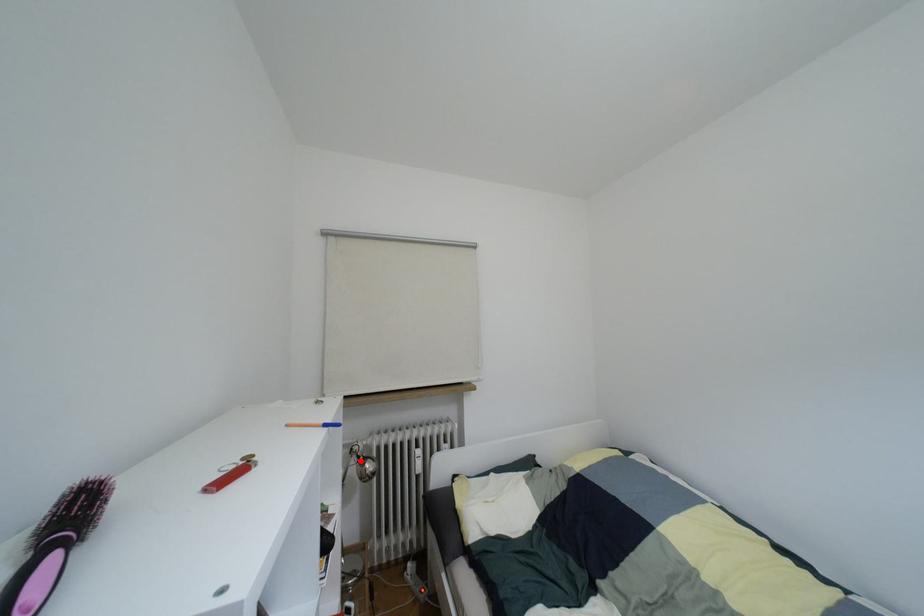
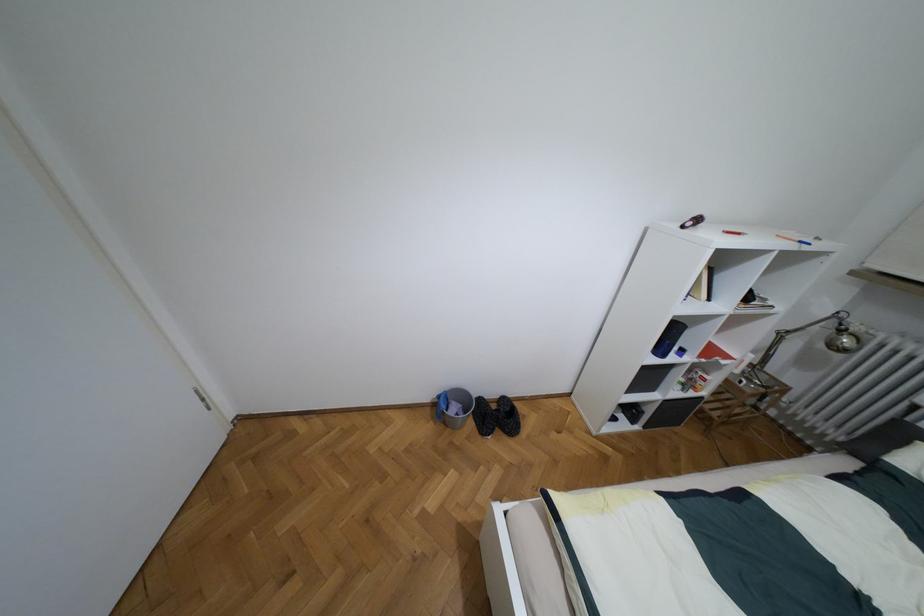
Find the pixel in the second image that matches the highlighted location in the first image.

(840, 330)